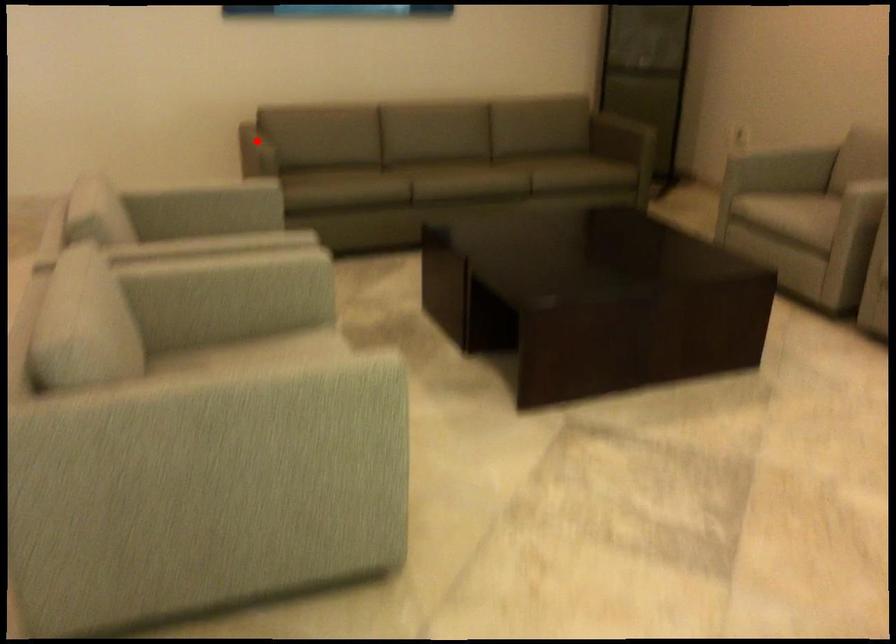
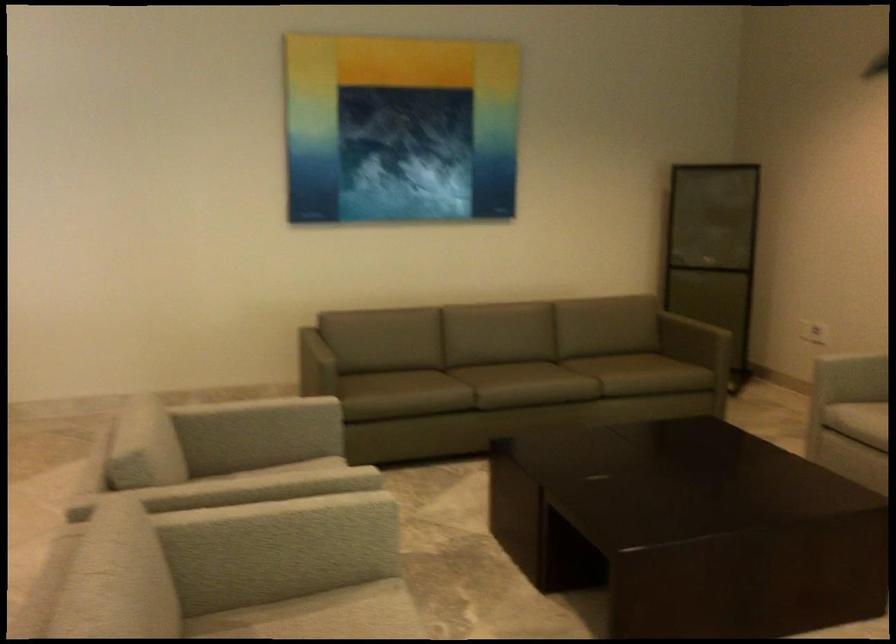
Question: I am providing you with two images of the same scene from different viewpoints. A red point is marked on the first image. Is the red point's position out of view in image 2?

Choices:
 (A) Yes
 (B) No

Answer: (B)